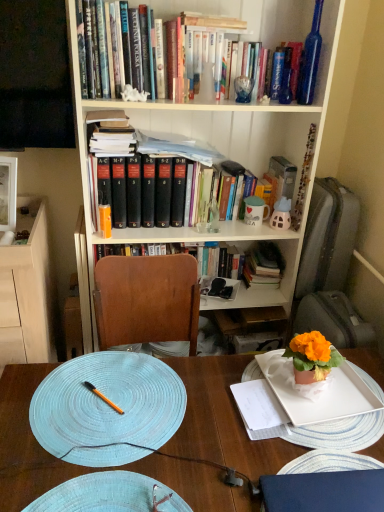
At what (x,y) coordinates should I click in order to perform the action: click on free space above blue woven placemat at center, arranged as the 1th plate when viewed from the left (from a real-world perspective). Please return your answer as a coordinate pair (x, y). Looking at the image, I should click on (109, 396).